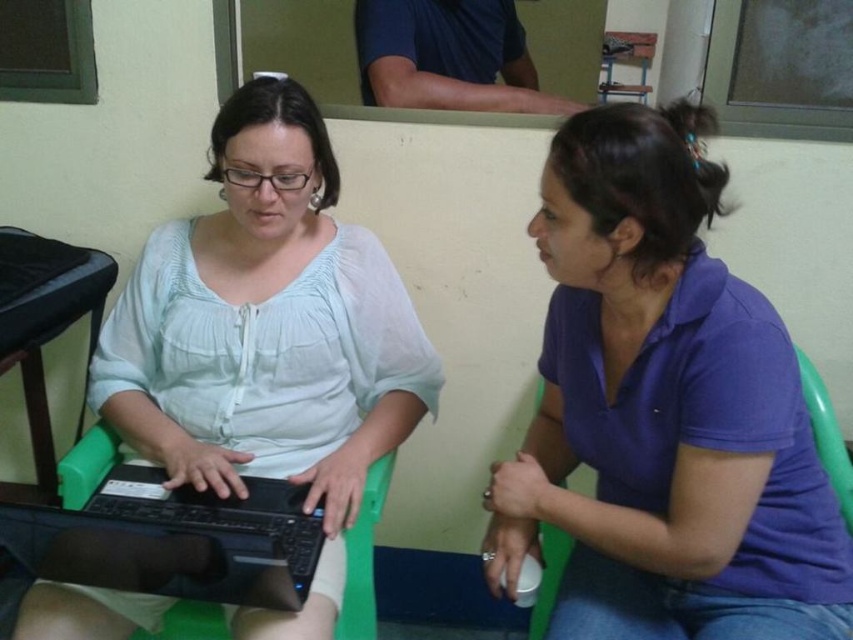
Which of these two, purple cotton shirt at center or green plastic chair at lower right, stands taller?

With more height is purple cotton shirt at center.

Locate an element on the screen. purple cotton shirt at center is located at coordinates pyautogui.click(x=664, y=410).

Identify the location of matte white shirt at center. This screenshot has height=640, width=853. (267, 339).

Between point (183, 248) and point (74, 484), which one is positioned behind?

The point (183, 248) is behind.

I want to click on matte white shirt at center, so click(x=267, y=339).

Which is more to the left, matte white shirt at center or green plastic chair at lower right?

From the viewer's perspective, matte white shirt at center appears more on the left side.

How far apart are matte white shirt at center and green plastic chair at lower right?

matte white shirt at center and green plastic chair at lower right are 36.93 inches apart from each other.

Which is in front, point (148, 436) or point (561, 547)?

Positioned in front is point (561, 547).

Identify the location of matte white shirt at center. (267, 339).